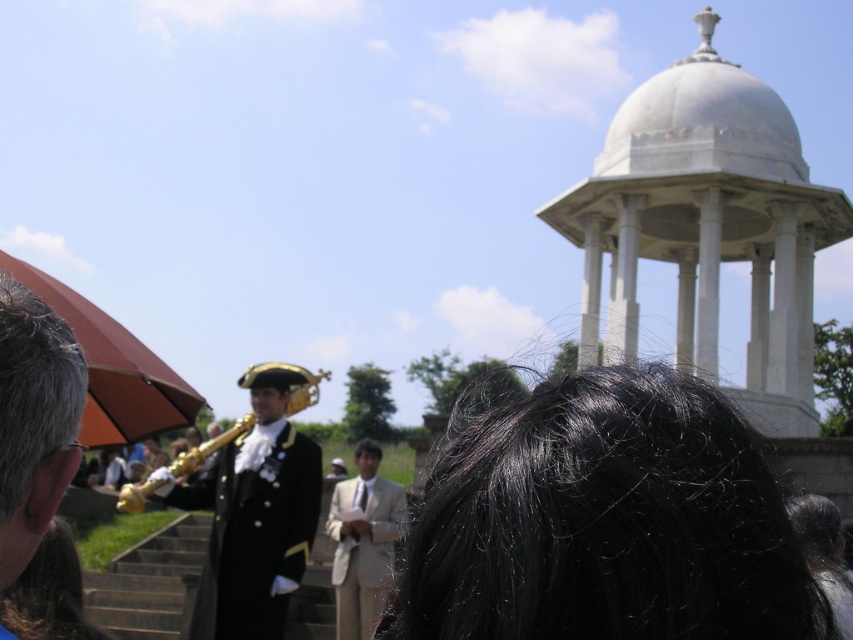
Question: Does brown matte umbrella at upper left appear over beige fabric suit at center?

Choices:
 (A) yes
 (B) no

Answer: (A)

Question: Which point appears closest to the camera in this image?

Choices:
 (A) (200, 573)
 (B) (366, 460)
 (C) (135, 364)
 (D) (772, 301)

Answer: (C)

Question: Does shiny black coat at center appear on the right side of gold brass instrument at center?

Choices:
 (A) yes
 (B) no

Answer: (A)

Question: Among these objects, which one is nearest to the camera?

Choices:
 (A) white marble gazebo at upper right
 (B) beige fabric suit at center

Answer: (A)

Question: Does shiny black coat at center have a lesser width compared to beige fabric suit at center?

Choices:
 (A) yes
 (B) no

Answer: (B)

Question: Which point is closer to the camera?

Choices:
 (A) (734, 221)
 (B) (137, 419)
 (C) (378, 493)
 (D) (230, 593)

Answer: (B)